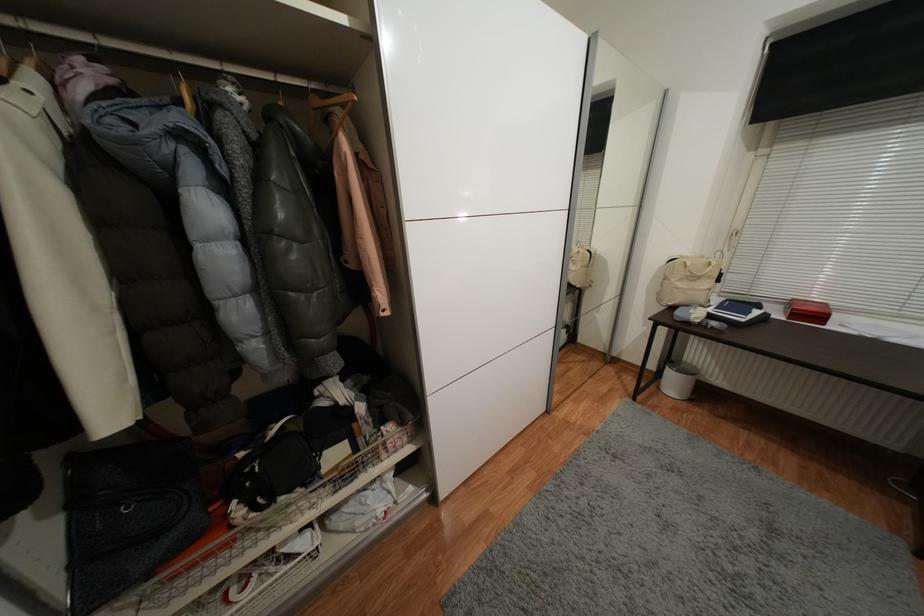
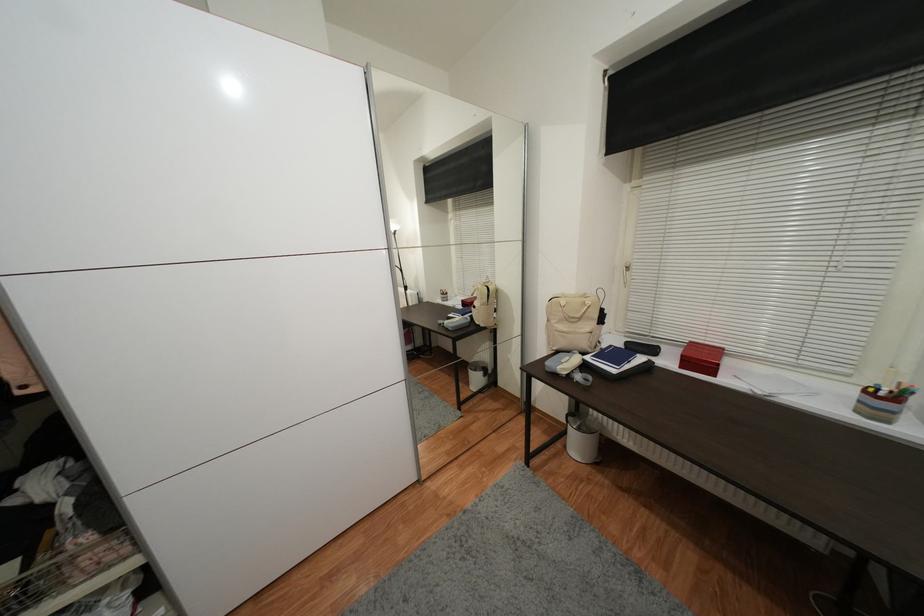
In the second image, find the point that corresponds to point 714,312 in the first image.

(592, 360)